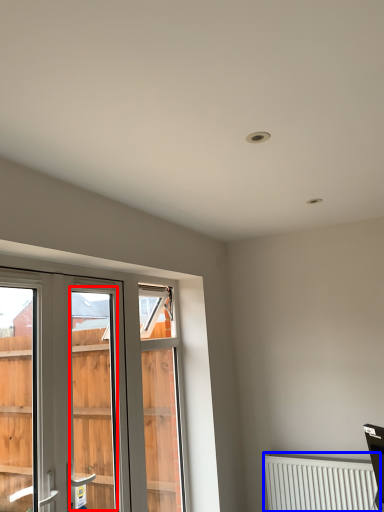
Question: Among these objects, which one is nearest to the camera, screen door (highlighted by a red box) or radiator (highlighted by a blue box)?

Choices:
 (A) screen door
 (B) radiator

Answer: (A)